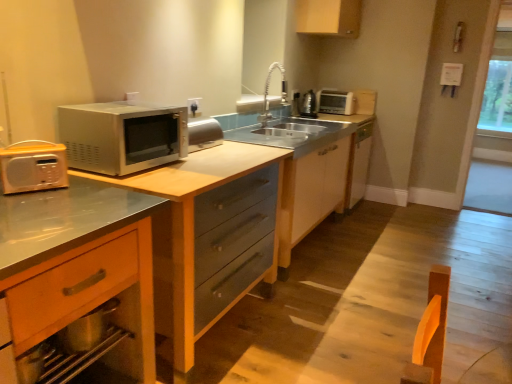
Where is `transparent glass window at upper right, which appears as the 2th window screen when viewed from the left`? transparent glass window at upper right, which appears as the 2th window screen when viewed from the left is located at coordinates (499, 79).

Locate an element on the screen. Image resolution: width=512 pixels, height=384 pixels. satin nickel faucet at center is located at coordinates (271, 96).

Locate an element on the screen. This screenshot has width=512, height=384. metallic silver kettle at upper right is located at coordinates (308, 105).

Is transparent glass window at right, which is the 2th window screen in right-to-left order, beside metallic silver kettle at upper right?

No, transparent glass window at right, which is the 2th window screen in right-to-left order, is not touching metallic silver kettle at upper right.

Looking at this image, considering the positions of objects transparent glass window at right, positioned as the first window screen in front-to-back order, and metallic silver kettle at upper right in the image provided, who is more to the left, transparent glass window at right, positioned as the first window screen in front-to-back order, or metallic silver kettle at upper right?

metallic silver kettle at upper right is more to the left.

From their relative heights in the image, would you say transparent glass window at right, which is counted as the first window screen, starting from the left, is taller or shorter than metallic silver kettle at upper right?

In the image, transparent glass window at right, which is counted as the first window screen, starting from the left, appears to be taller than metallic silver kettle at upper right.

How much distance is there between white plastic electric outlet at upper center and matte wood cabinet at upper center, marked as the 2th cabinetry in a right-to-left arrangement?

white plastic electric outlet at upper center is 5.78 feet away from matte wood cabinet at upper center, marked as the 2th cabinetry in a right-to-left arrangement.

From a real-world perspective, is white plastic electric outlet at upper center beneath matte wood cabinet at upper center, marked as the 2th cabinetry in a right-to-left arrangement?

Yes.

Locate an element on the screen. electric outlet located underneath the matte wood cabinet at upper center, placed as the second cabinetry when sorted from left to right (from a real-world perspective) is located at coordinates (194, 106).

In terms of width, does white plastic electric outlet at upper center look wider or thinner when compared to matte wood cabinet at upper center, arranged as the third cabinetry when ordered from the bottom?

white plastic electric outlet at upper center is thinner than matte wood cabinet at upper center, arranged as the third cabinetry when ordered from the bottom.

Considering the sizes of objects wooden drawer at lower left, positioned as the 3th cabinetry in top-to-bottom order, and satin silver microwave at left in the image provided, who is taller, wooden drawer at lower left, positioned as the 3th cabinetry in top-to-bottom order, or satin silver microwave at left?

Standing taller between the two is wooden drawer at lower left, positioned as the 3th cabinetry in top-to-bottom order.

Is point (149, 230) positioned behind point (114, 133)?

That is False.

Consider the image. Is wooden drawer at lower left, the 1th cabinetry viewed from the left, placed right next to satin silver microwave at left?

No, wooden drawer at lower left, the 1th cabinetry viewed from the left, is not beside satin silver microwave at left.

Could you tell me if wooden drawer at lower left, the first cabinetry positioned from the front, is facing satin silver microwave at left?

No, wooden drawer at lower left, the first cabinetry positioned from the front, does not turn towards satin silver microwave at left.

From a real-world perspective, between wooden drawer at lower left, the 1th cabinetry positioned from the bottom, and transparent glass window at right, which is the second window screen in back-to-front order, who is vertically higher?

In real-world perspective, transparent glass window at right, which is the second window screen in back-to-front order, is above.

How far apart are wooden drawer at lower left, the 1th cabinetry positioned from the bottom, and transparent glass window at right, positioned as the first window screen in front-to-back order?

They are 12.62 feet apart.

From the image's perspective, which object appears higher, wooden drawer at lower left, acting as the third cabinetry starting from the right, or transparent glass window at right, positioned as the first window screen in front-to-back order?

transparent glass window at right, positioned as the first window screen in front-to-back order, is shown above in the image.

Considering the positions of objects wooden drawer at lower left, acting as the third cabinetry starting from the right, and transparent glass window at right, which is the second window screen in back-to-front order, in the image provided, who is more to the right, wooden drawer at lower left, acting as the third cabinetry starting from the right, or transparent glass window at right, which is the second window screen in back-to-front order,?

transparent glass window at right, which is the second window screen in back-to-front order.

This screenshot has width=512, height=384. Find the location of `electric outlet in front of the transparent glass window at right, which is the 2th window screen in right-to-left order`. electric outlet in front of the transparent glass window at right, which is the 2th window screen in right-to-left order is located at coordinates (194, 106).

Could you tell me if transparent glass window at right, which is the second window screen in back-to-front order, is facing white plastic electric outlet at upper center?

No, transparent glass window at right, which is the second window screen in back-to-front order, does not turn towards white plastic electric outlet at upper center.

Between transparent glass window at right, which is the second window screen in back-to-front order, and white plastic electric outlet at upper center, which one has larger width?

transparent glass window at right, which is the second window screen in back-to-front order.

Which object is positioned more to the left, transparent glass window at right, which is the 2th window screen in right-to-left order, or white plastic electric outlet at upper center?

white plastic electric outlet at upper center is more to the left.

Is matte wood cabinet at upper center, acting as the second cabinetry starting from the front, behind satin wood dresser at center?

Yes, matte wood cabinet at upper center, acting as the second cabinetry starting from the front, is behind satin wood dresser at center.

Is matte wood cabinet at upper center, marked as the 2th cabinetry in a right-to-left arrangement, positioned far away from satin wood dresser at center?

That's right, there is a large distance between matte wood cabinet at upper center, marked as the 2th cabinetry in a right-to-left arrangement, and satin wood dresser at center.

Visually, is matte wood cabinet at upper center, the 2th cabinetry from the back, positioned to the left or to the right of satin wood dresser at center?

Clearly, matte wood cabinet at upper center, the 2th cabinetry from the back, is on the right of satin wood dresser at center in the image.

Which object is wider, matte wood cabinet at upper center, marked as the 2th cabinetry in a right-to-left arrangement, or satin wood dresser at center?

Wider between the two is satin wood dresser at center.

Considering the relative sizes of white plastic toaster at upper right and matte wood cabinet at upper center, the 2th cabinetry from the back, in the image provided, is white plastic toaster at upper right wider than matte wood cabinet at upper center, the 2th cabinetry from the back,?

Correct, the width of white plastic toaster at upper right exceeds that of matte wood cabinet at upper center, the 2th cabinetry from the back.

From the image's perspective, does white plastic toaster at upper right appear higher than matte wood cabinet at upper center, the 2th cabinetry from the back?

No, from the image's perspective, white plastic toaster at upper right is not above matte wood cabinet at upper center, the 2th cabinetry from the back.

Where is `cabinetry above the white plastic toaster at upper right (from the image's perspective)`? This screenshot has height=384, width=512. cabinetry above the white plastic toaster at upper right (from the image's perspective) is located at coordinates (328, 17).

Is white plastic toaster at upper right not close to matte wood cabinet at upper center, the 2th cabinetry from the back?

No, there isn't a large distance between white plastic toaster at upper right and matte wood cabinet at upper center, the 2th cabinetry from the back.

This screenshot has height=384, width=512. Find the location of `window screen below the metallic silver kettle at upper right (from the image's perspective)`. window screen below the metallic silver kettle at upper right (from the image's perspective) is located at coordinates (494, 128).

Where is `the 1st cabinetry behind the white plastic electric outlet at upper center`? Image resolution: width=512 pixels, height=384 pixels. the 1st cabinetry behind the white plastic electric outlet at upper center is located at coordinates (328, 17).

Considering their positions, is transparent glass window at upper right, which appears as the 2th window screen when viewed from the left, positioned further to satin wood dresser at center than white plastic electric outlet at upper center?

The object further to satin wood dresser at center is transparent glass window at upper right, which appears as the 2th window screen when viewed from the left.

Estimate the real-world distances between objects in this image. Which object is further from transparent glass window at right, which is the second window screen in back-to-front order, transparent glass window at upper right, which appears as the 2th window screen when viewed from the left, or satin wood dresser at center?

satin wood dresser at center is positioned further to the anchor transparent glass window at right, which is the second window screen in back-to-front order.

From the image, which object appears to be farther from satin nickel faucet at center, transparent glass window at right, which is counted as the first window screen, starting from the left, or metallic silver kettle at upper right?

transparent glass window at right, which is counted as the first window screen, starting from the left, lies further to satin nickel faucet at center than the other object.

Looking at this image, which object lies further to the anchor point satin silver microwave at left, satin wood dresser at center or matte wood cabinet at upper center, the 2th cabinetry from the back?

matte wood cabinet at upper center, the 2th cabinetry from the back.

Looking at the image, which one is located further to satin silver microwave at left, metallic silver kettle at upper right or matte wood cabinet at upper center, acting as the second cabinetry starting from the front?

metallic silver kettle at upper right is positioned further to the anchor satin silver microwave at left.

Based on their spatial positions, is transparent glass window at right, which is the second window screen in back-to-front order, or satin nickel faucet at center further from metallic silver kettle at upper right?

transparent glass window at right, which is the second window screen in back-to-front order, lies further to metallic silver kettle at upper right than the other object.

From the image, which object appears to be nearer to white plastic electric outlet at upper center, metallic silver kettle at upper right or satin nickel faucet at center?

satin nickel faucet at center lies closer to white plastic electric outlet at upper center than the other object.

Considering their positions, is satin silver microwave at left positioned further to satin nickel faucet at center than wooden drawer at lower left, the 1th cabinetry positioned from the bottom?

wooden drawer at lower left, the 1th cabinetry positioned from the bottom, is further to satin nickel faucet at center.

At what (x,y) coordinates should I click in order to perform the action: click on dresser situated between white plastic electric outlet at upper center and transparent glass window at right, which is the second window screen in back-to-front order, from left to right. Please return your answer as a coordinate pair (x, y). The height and width of the screenshot is (384, 512). Looking at the image, I should click on (314, 170).

The height and width of the screenshot is (384, 512). Identify the location of countertop between satin silver microwave at left and transparent glass window at right, which is the second window screen in back-to-front order. (x=244, y=214).

Image resolution: width=512 pixels, height=384 pixels. I want to click on dresser positioned between satin silver microwave at left and white plastic electric outlet at upper center from near to far, so click(314, 170).

Identify the location of microwave oven between metallic silver microwave at left and white plastic toaster at upper right in the front-back direction. (122, 136).